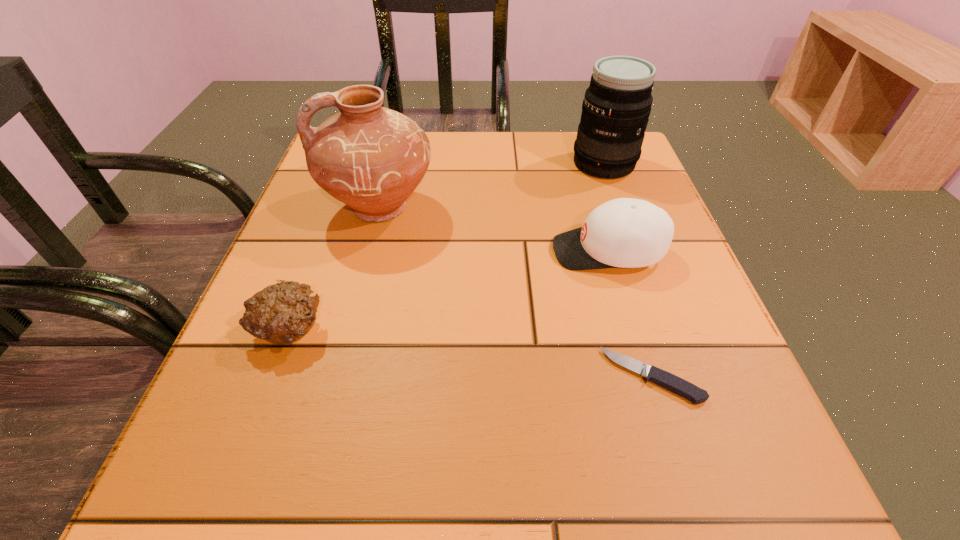
Where is `vacant position in the image that satisfies the following two spatial constraints: 1. on the front-facing side of the shortest object; 2. on the left side of the third tallest object`? vacant position in the image that satisfies the following two spatial constraints: 1. on the front-facing side of the shortest object; 2. on the left side of the third tallest object is located at coordinates (645, 376).

Identify the location of free space in the image that satisfies the following two spatial constraints: 1. on the front-facing side of the steak knife; 2. on the left side of the baseball cap. (645, 376).